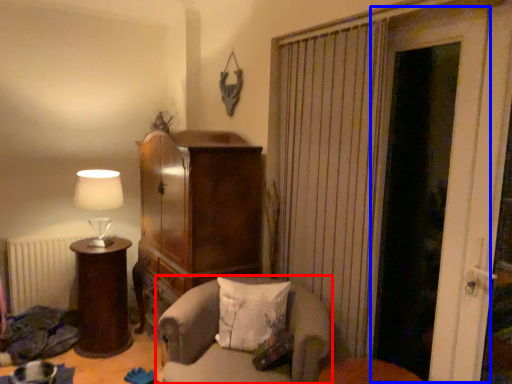
Question: Which object is further to the camera taking this photo, chair (highlighted by a red box) or door (highlighted by a blue box)?

Choices:
 (A) chair
 (B) door

Answer: (A)